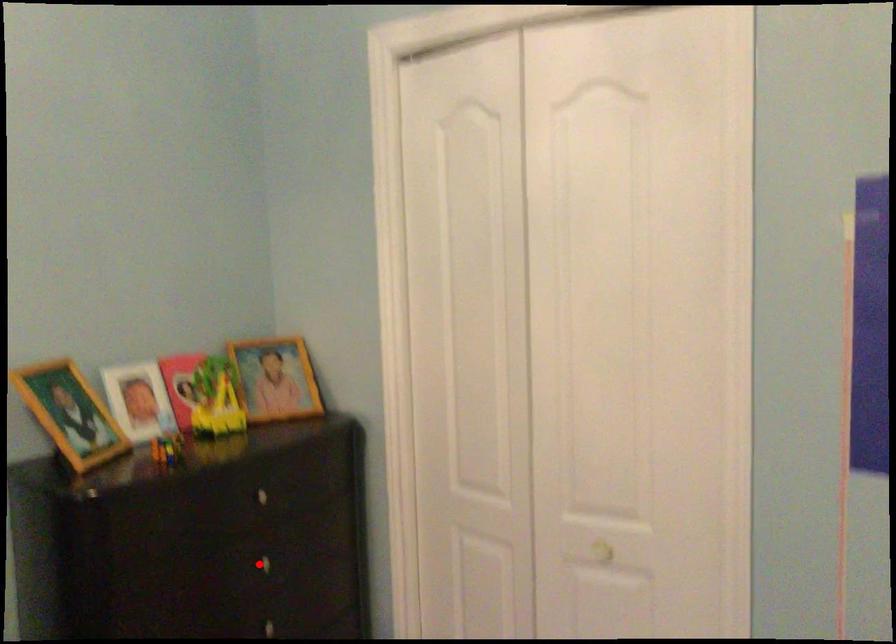
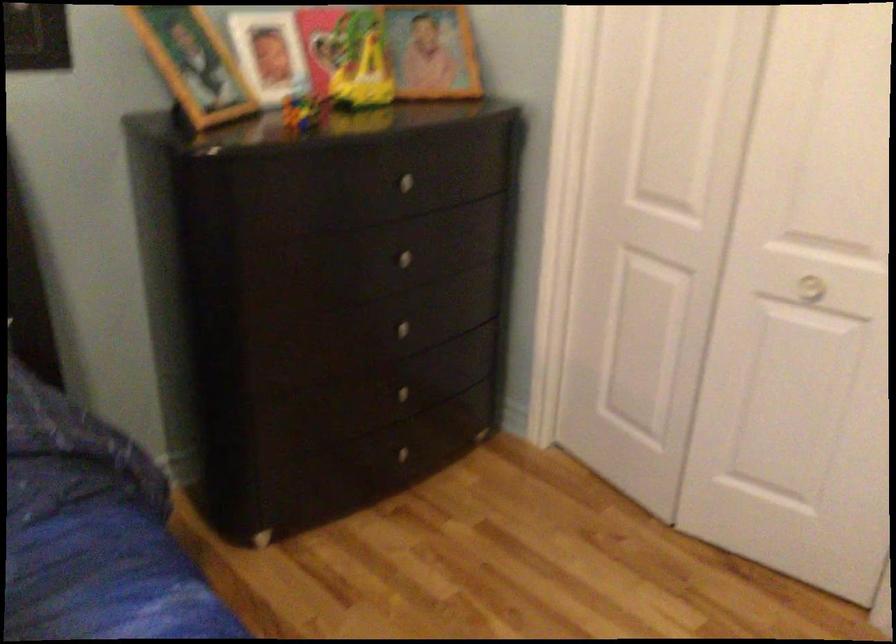
In the second image, find the point that corresponds to the highlighted location in the first image.

(399, 258)